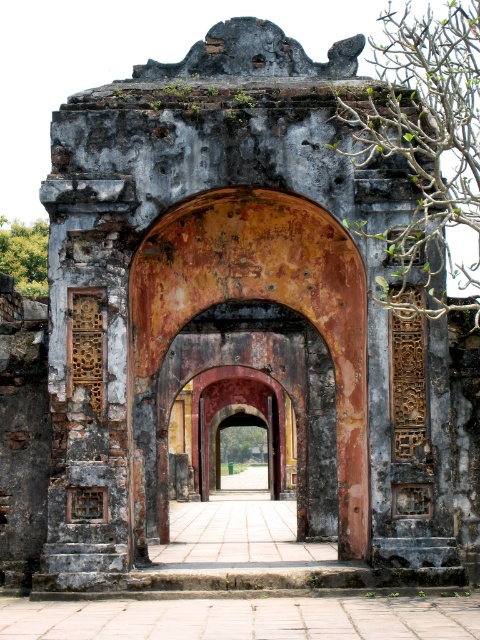
Is smooth stone path at center bigger than green leafy tree at center?

No.

Image resolution: width=480 pixels, height=640 pixels. What do you see at coordinates (244, 618) in the screenshot? I see `smooth stone path at center` at bounding box center [244, 618].

Find the location of a particular element. The width and height of the screenshot is (480, 640). smooth stone path at center is located at coordinates (244, 618).

Is point (469, 16) positioned before point (312, 554)?

Yes, it is in front of point (312, 554).

Can you confirm if green leafy branches at upper right is positioned above rustic stone pathway at center?

Yes.

Which is behind, point (408, 32) or point (255, 560)?

The point (255, 560) is more distant.

This screenshot has height=640, width=480. In order to click on green leafy branches at upper right in this screenshot , I will do `click(424, 145)`.

Can you confirm if smooth stone path at center is taller than rustic stone pathway at center?

No.

Is point (80, 620) positioned behind point (239, 484)?

That is False.

In order to click on smooth stone path at center in this screenshot , I will do `click(244, 618)`.